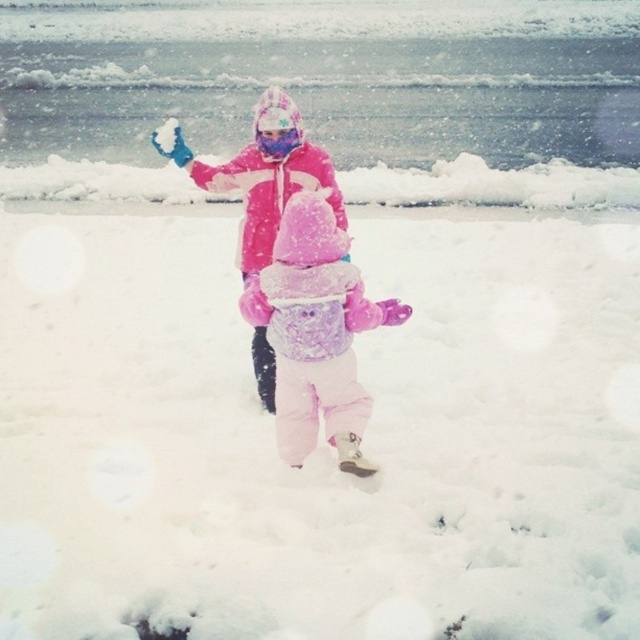
Based on the photo, you are a photographer trying to capture both the fluffy pink snowsuit at center and the pink fleece jacket at center in a single frame. Based on their sizes, which object should you focus on to ensure both fit in the photo without cropping?

The fluffy pink snowsuit at center is narrower than the pink fleece jacket at center, so focusing on the larger pink fleece jacket at center ensures both fit in the frame without cropping.

You are a drone operator trying to capture a photo of the fluffy pink snowsuit at center. The drone is currently hovering at point A, which is at coordinates 0.450, 0.450. To get the best shot, you need to move the drone directly above the snowsuit. Should you adjust the drone to the north, south, east, or west to reach the correct position?

The fluffy pink snowsuit at center is located at point (316, 332). Since the drone is at (288, 288), you need to move it east and slightly north to reach the correct position.